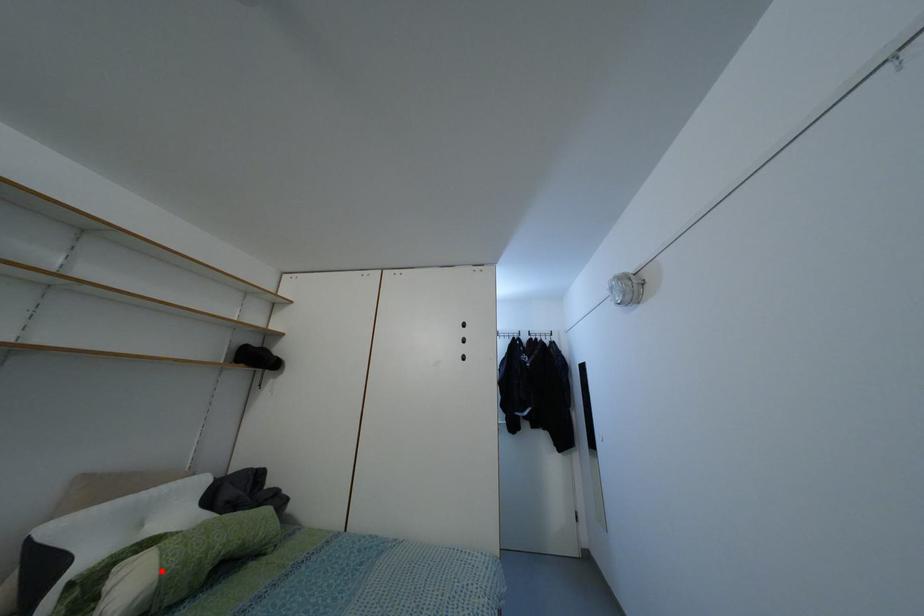
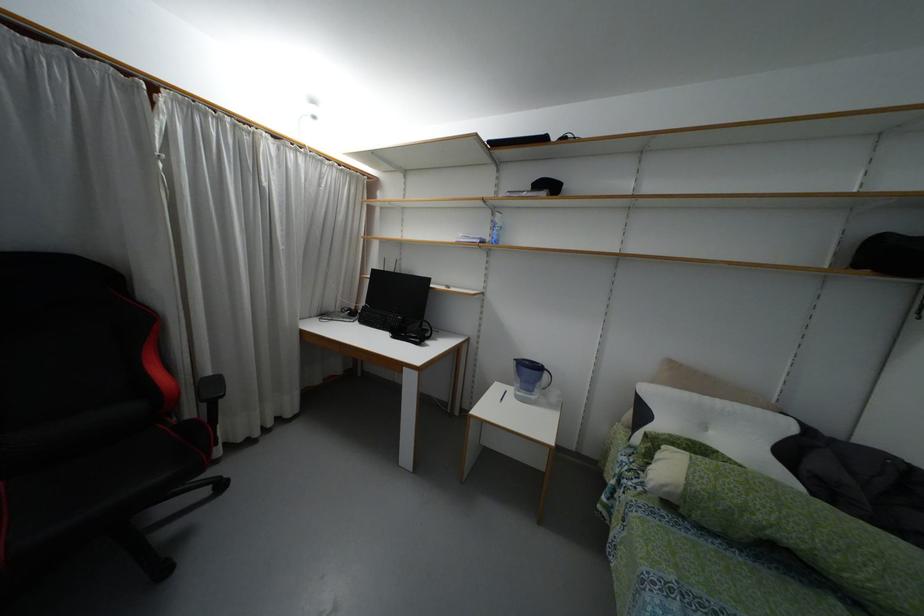
Question: A red point is marked in image1. In image2, is the corresponding 3D point closer to the camera or farther? Reply with the corresponding letter.

Choices:
 (A) The corresponding 3D point is closer.
 (B) The corresponding 3D point is farther.

Answer: (B)